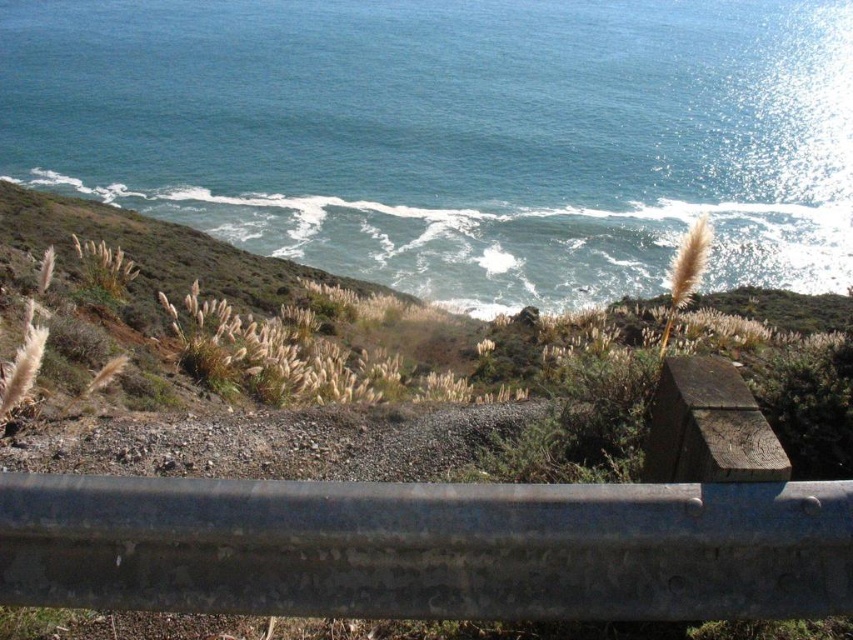
You are standing at the edge of the guardrail and want to take a photo of the blue water at upper center and the gray metallic rail at center. Which object should you focus on first if you want both to be in clear focus?

The gray metallic rail at center is closer to you than the blue water at upper center, so you should focus on the gray metallic rail at center first to ensure both are in focus.

You are standing at the roadside and see the blue water at upper center and the dry grass at center. Which one takes up more space in the image?

The blue water at upper center takes up more space in the image because it is bigger than the dry grass at center.

You are a hiker who wants to cross the terrain. You see the dry grass at center and the gray metallic rail at center. Which one is wider?

The dry grass at center is wider than the gray metallic rail at center according to the description.